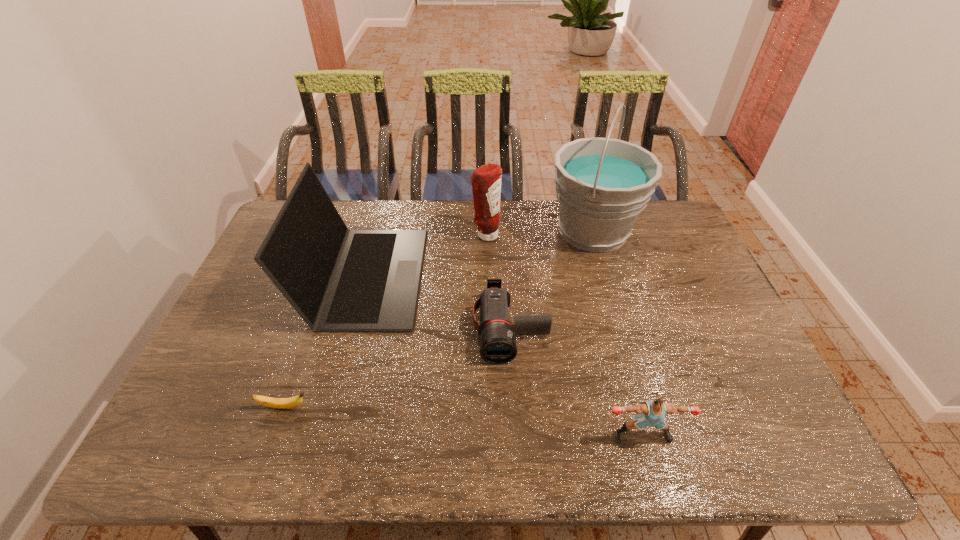
This screenshot has height=540, width=960. Identify the location of free space that is in between the nearest object and the bucket. (618, 333).

Locate an element on the screen. free space between the tallest object and the shortest object is located at coordinates (439, 319).

Identify the location of unoccupied position between the condiment and the laptop. This screenshot has height=540, width=960. (425, 255).

Identify the location of object that stands as the second closest to the laptop. (497, 341).

Choose which object is the third nearest neighbor to the laptop. Please provide its 2D coordinates. Your answer should be formatted as a tuple, i.e. [(x, y)], where the tuple contains the x and y coordinates of a point satisfying the conditions above.

[(281, 403)]

Where is `free location that satisfies the following two spatial constraints: 1. on the front side of the condiment; 2. at the stem of the shortest object`? Image resolution: width=960 pixels, height=540 pixels. free location that satisfies the following two spatial constraints: 1. on the front side of the condiment; 2. at the stem of the shortest object is located at coordinates (489, 407).